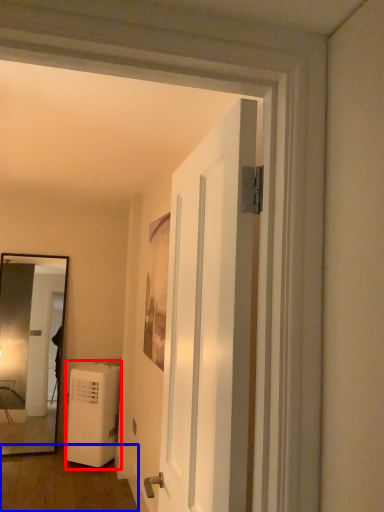
Question: Which object appears closest to the camera in this image, air conditioner (highlighted by a red box) or corridor (highlighted by a blue box)?

Choices:
 (A) air conditioner
 (B) corridor

Answer: (B)